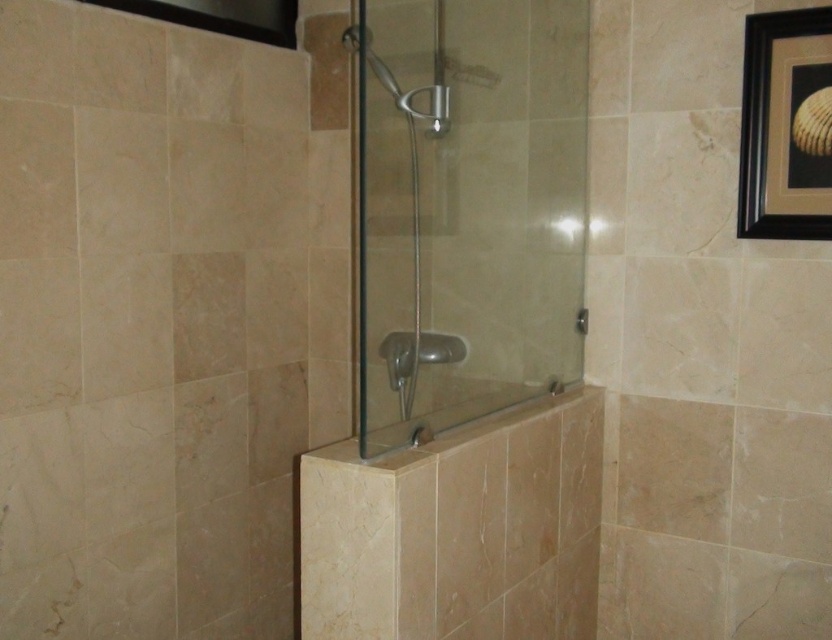
You are holding a 4 feet long pole and want to measure the distance from your current position to the point labeled as point (325,474) in the shower area. Can you reach that point with the pole?

The distance between you and the point (325,474) is 4.36 feet. Since your pole is 4 feet long, you cannot reach the point as the pole is shorter than the required distance.

You are standing in the shower area and want to reach the clear glass shower head at center to adjust the water temperature. However, there is a beige marble bath at center in your way. Can you still reach the shower head without moving the bath?

The beige marble bath at center is in front of the clear glass shower head at center, so you cannot reach the shower head without moving the bath.

You are a contractor measuring the height of the transparent glass shower door at center and the clear glass shower head at center for installation purposes. Which object has a greater height?

The transparent glass shower door at center is taller than the clear glass shower head at center, so the shower door has a greater height.